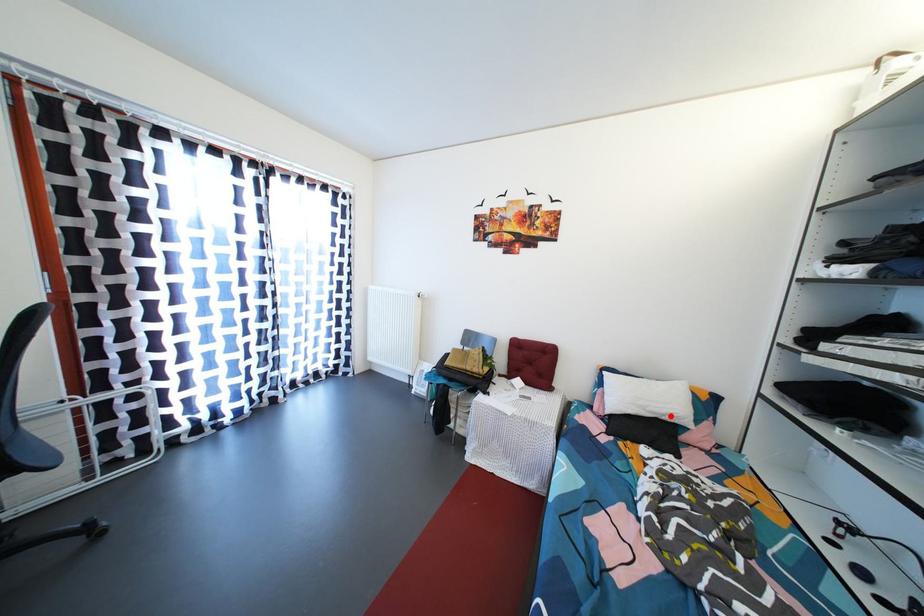
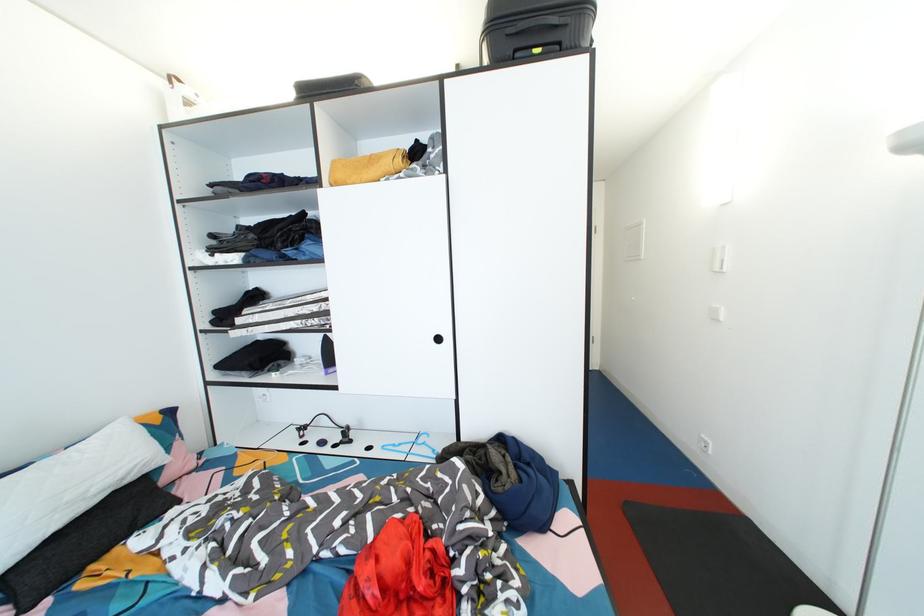
In the second image, find the point that corresponds to the highlighted location in the first image.

(128, 477)